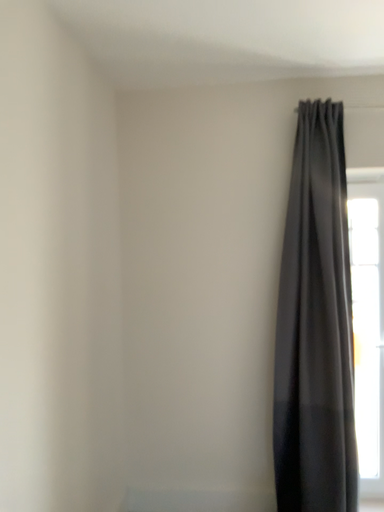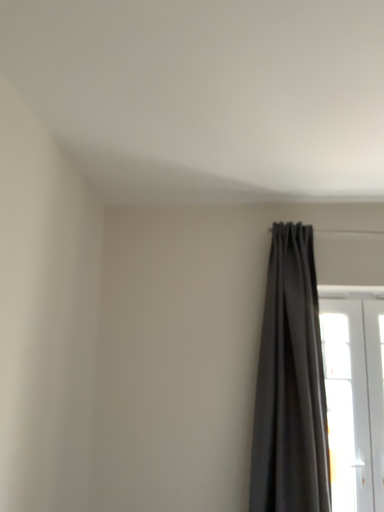
Question: Which way did the camera rotate in the video?

Choices:
 (A) rotated upward
 (B) rotated downward

Answer: (A)